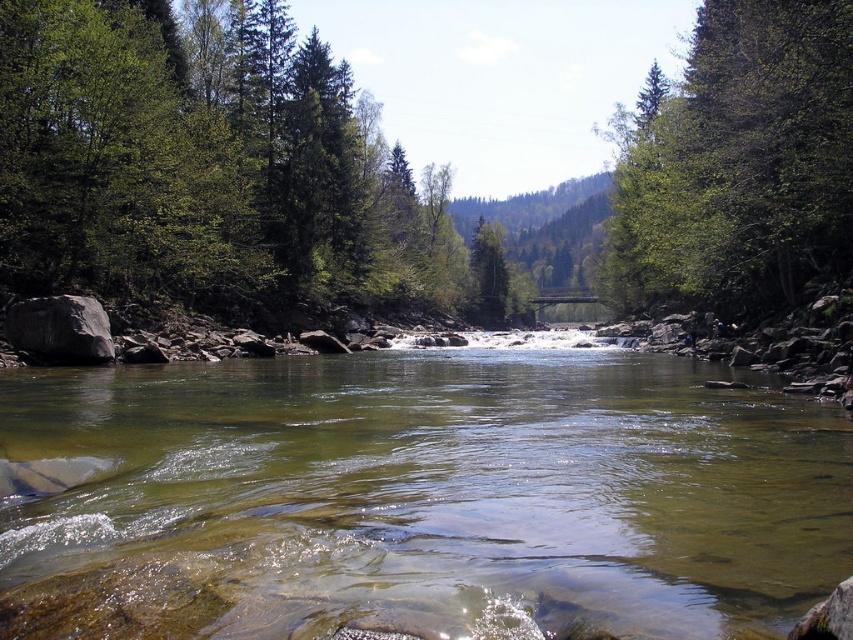
Is green leafy tree at upper right wider than gray smooth rock at left?

Yes.

Between green leafy tree at upper right and gray smooth rock at left, which one appears on the left side from the viewer's perspective?

gray smooth rock at left

Where is `green leafy tree at upper right`? green leafy tree at upper right is located at coordinates (738, 163).

Which of these two, clear water at center or green leafy tree at upper left, stands taller?

Standing taller between the two is green leafy tree at upper left.

Which is more to the right, clear water at center or green leafy tree at upper left?

From the viewer's perspective, clear water at center appears more on the right side.

Between point (18, 384) and point (38, 106), which one is positioned in front?

Point (18, 384) is in front.

Find the location of a particular element. Image resolution: width=853 pixels, height=640 pixels. clear water at center is located at coordinates (416, 499).

Is the position of green leafy tree at upper left less distant than that of green leafy tree at upper right?

No, it is not.

Is green leafy tree at upper left shorter than green leafy tree at upper right?

No, green leafy tree at upper left is not shorter than green leafy tree at upper right.

The height and width of the screenshot is (640, 853). What are the coordinates of `green leafy tree at upper left` in the screenshot? It's located at pos(202,168).